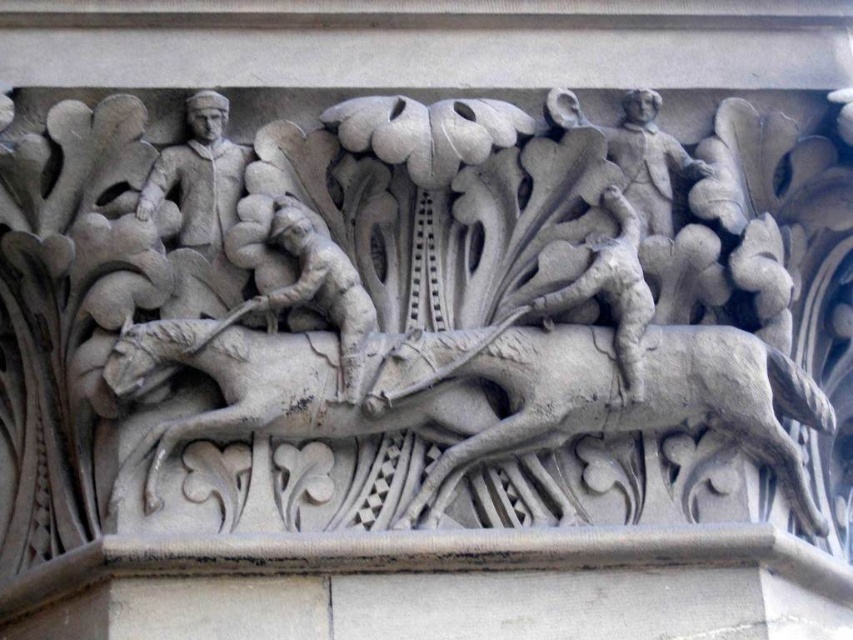
Question: Is gray stone horse at center smaller than gray stone figure at center?

Choices:
 (A) yes
 (B) no

Answer: (B)

Question: Does stone horse at center appear under gray stone figure at center?

Choices:
 (A) yes
 (B) no

Answer: (B)

Question: Which of the following is the farthest from the observer?

Choices:
 (A) gray stone horse at center
 (B) stone horse at center

Answer: (A)

Question: Which point is farther from the camera taking this photo?

Choices:
 (A) (328, 266)
 (B) (282, 362)
 (C) (506, 388)

Answer: (C)

Question: Can you confirm if gray stone horse at center is wider than gray stone figure at center?

Choices:
 (A) no
 (B) yes

Answer: (B)

Question: Which point appears farthest from the camera in this image?

Choices:
 (A) (467, 364)
 (B) (296, 276)
 (C) (346, 422)

Answer: (B)